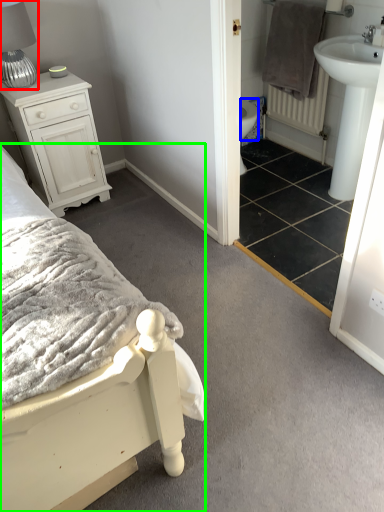
Question: Estimate the real-world distances between objects in this image. Which object is farther from table lamp (highlighted by a red box), bidet (highlighted by a blue box) or bed (highlighted by a green box)?

Choices:
 (A) bidet
 (B) bed

Answer: (A)